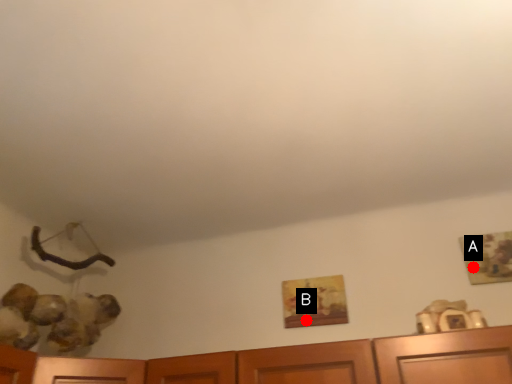
Question: Two points are circled on the image, labeled by A and B beside each circle. Among these points, which one is farthest from the camera?

Choices:
 (A) A is further
 (B) B is further

Answer: (B)